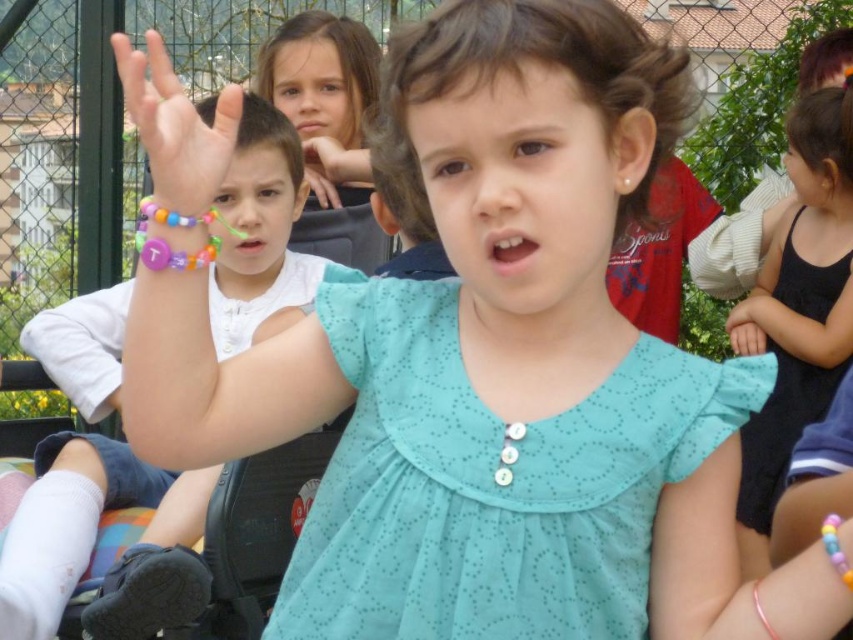
You are a photographer trying to capture a group photo of the children in the scene. The matte plastic face at center and smooth skin face at upper center are two of the subjects. Given that your camera has a depth of field that can clearly focus on subjects within a 7.5 feet range, will both subjects be in focus at the same time?

The matte plastic face at center and smooth skin face at upper center are 8.47 feet apart from each other. Since the distance between them exceeds the camera lens depth of field range of 7.5 feet, both subjects cannot be in focus simultaneously.